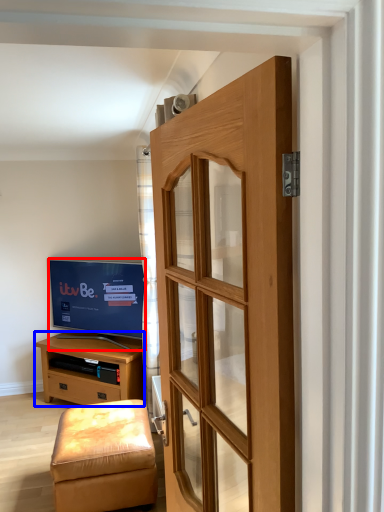
Question: Which point is further to the camera, television (highlighted by a red box) or chest of drawers (highlighted by a blue box)?

Choices:
 (A) television
 (B) chest of drawers

Answer: (A)